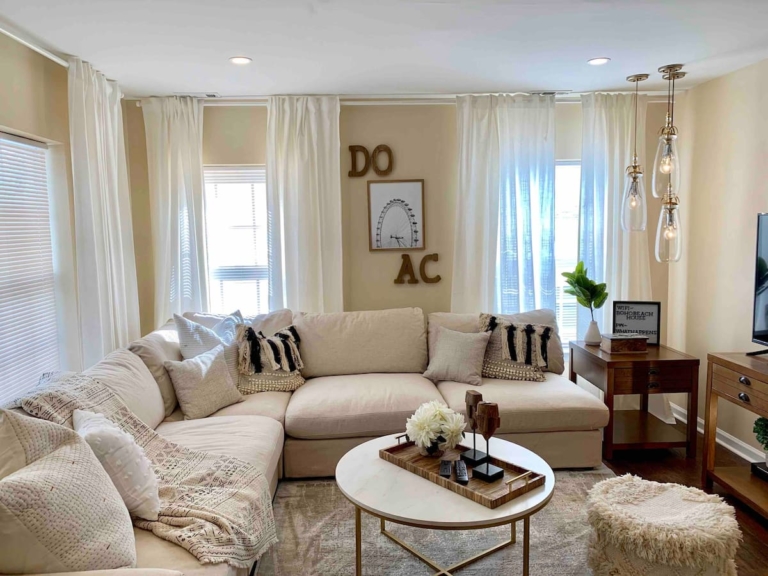
Find the location of a particular element. This screenshot has width=768, height=576. table is located at coordinates (650, 361), (405, 520), (742, 376).